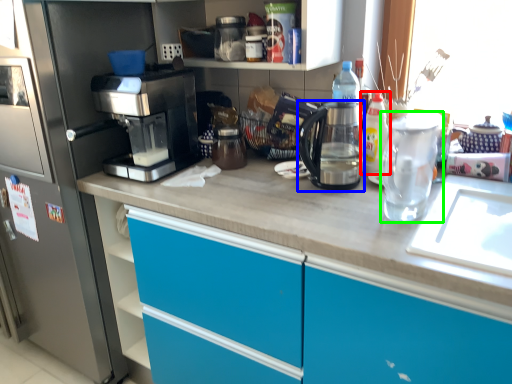
Question: Estimate the real-world distances between objects in this image. Which object is closer to bottle (highlighted by a red box), kitchen appliance (highlighted by a blue box) or tea pot (highlighted by a green box)?

Choices:
 (A) kitchen appliance
 (B) tea pot

Answer: (A)